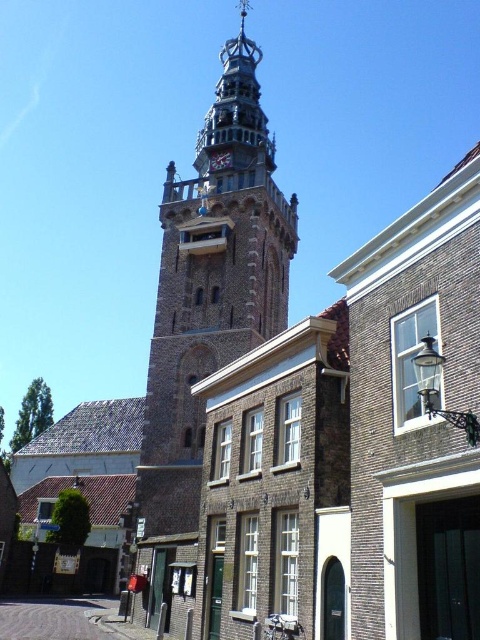
Question: Which point is farther to the camera?

Choices:
 (A) (211, 163)
 (B) (250, 52)

Answer: (B)

Question: Can you confirm if stone clock tower at center is positioned to the left of polished brass clock at center?

Choices:
 (A) yes
 (B) no

Answer: (B)

Question: Can you confirm if stone clock tower at center is thinner than polished brass clock at center?

Choices:
 (A) no
 (B) yes

Answer: (A)

Question: Which object is farther from the camera taking this photo?

Choices:
 (A) stone clock tower at center
 (B) polished brass clock at center

Answer: (B)

Question: Can you confirm if stone clock tower at center is positioned to the right of polished brass clock at center?

Choices:
 (A) no
 (B) yes

Answer: (B)